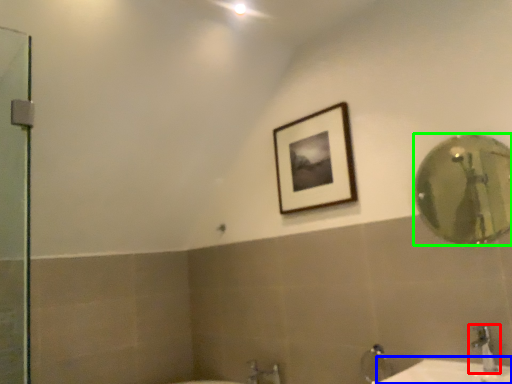
Question: Considering the real-world distances, which object is farthest from tap (highlighted by a red box)? counter top (highlighted by a blue box) or mirror (highlighted by a green box)?

Choices:
 (A) counter top
 (B) mirror

Answer: (B)